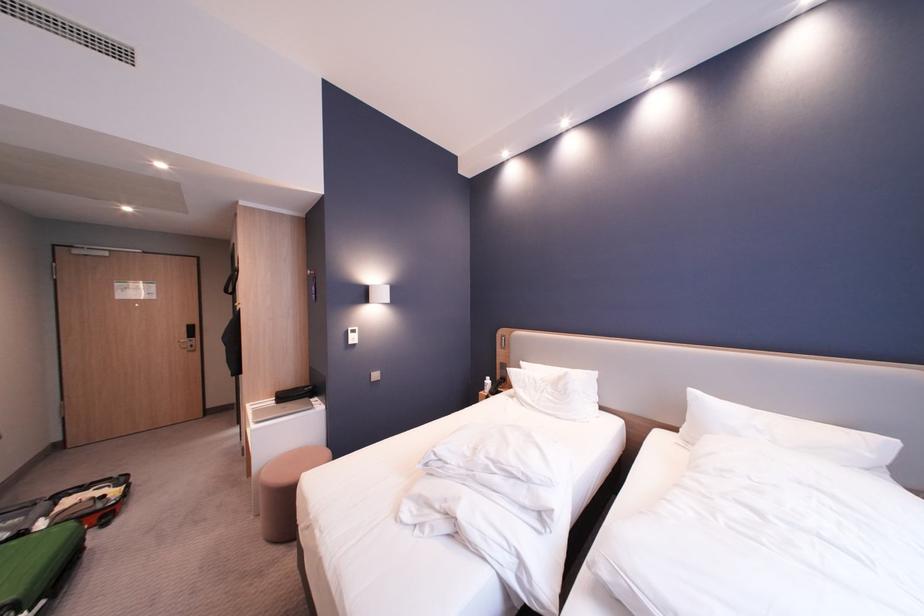
Identify the location of white light switch. (351, 334).